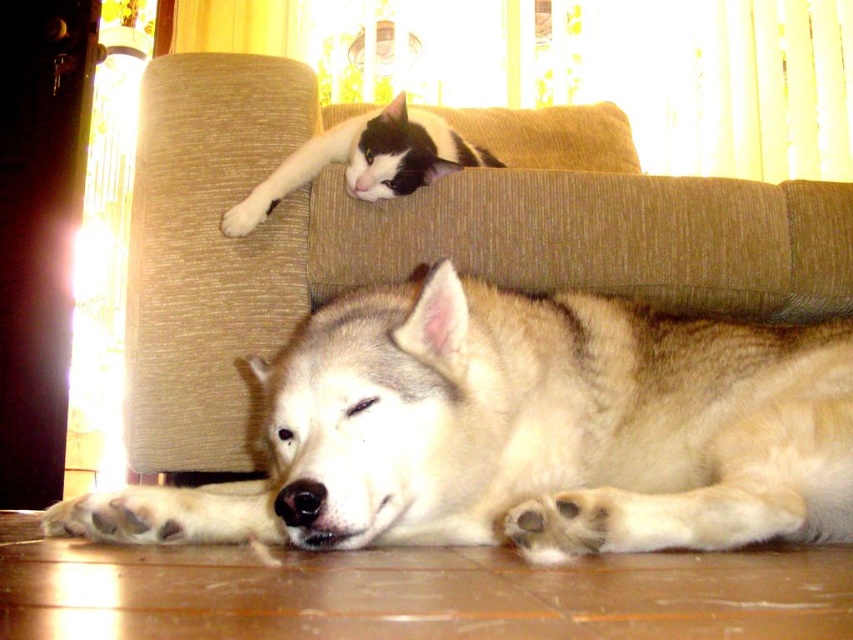
Question: Is beige fabric couch at upper center wider than white fur paw at upper left?

Choices:
 (A) yes
 (B) no

Answer: (A)

Question: Which point appears farthest from the camera in this image?

Choices:
 (A) (80, 504)
 (B) (299, 147)
 (C) (204, 333)
 (D) (228, 228)

Answer: (B)

Question: Which point is closer to the camera?

Choices:
 (A) white fur paw at upper left
 (B) fuzzy beige dog at lower center

Answer: (B)

Question: Which of the following is the closest to the observer?

Choices:
 (A) (459, 134)
 (B) (259, 218)

Answer: (B)

Question: Can you confirm if beige fabric couch at upper center is positioned to the left of white fur paw at upper left?

Choices:
 (A) yes
 (B) no

Answer: (B)

Question: Is black and white fur cat at upper center positioned before white fur paw at upper left?

Choices:
 (A) no
 (B) yes

Answer: (A)